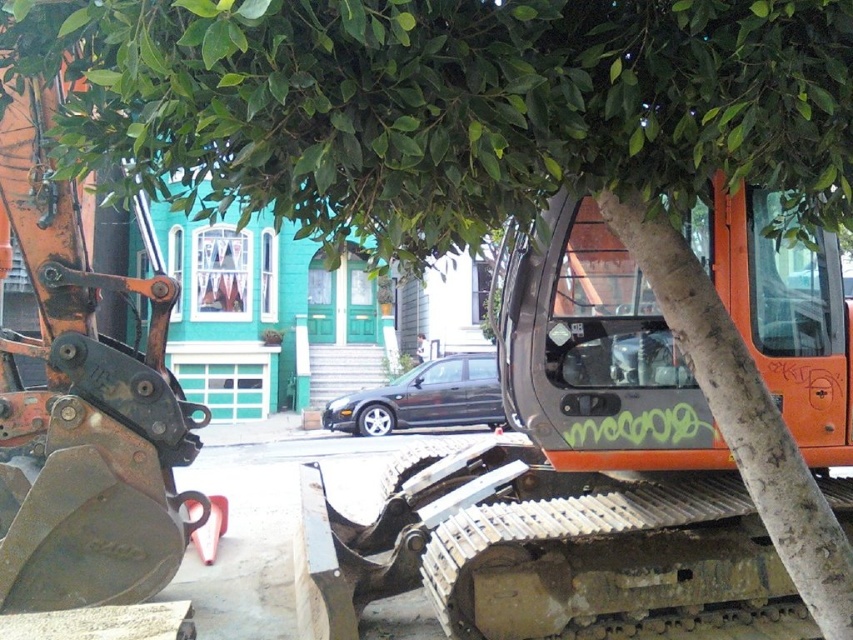
Question: Is green leafy tree at upper center to the left of rusty metal excavator at left from the viewer's perspective?

Choices:
 (A) no
 (B) yes

Answer: (A)

Question: Which of the following is the farthest from the observer?

Choices:
 (A) green leafy tree at upper center
 (B) rusty metal excavator at left

Answer: (B)

Question: Does green leafy tree at upper center lie in front of rusty metal excavator at left?

Choices:
 (A) yes
 (B) no

Answer: (A)

Question: Where is green leafy tree at upper center located in relation to rusty metal excavator at left in the image?

Choices:
 (A) below
 (B) above

Answer: (B)